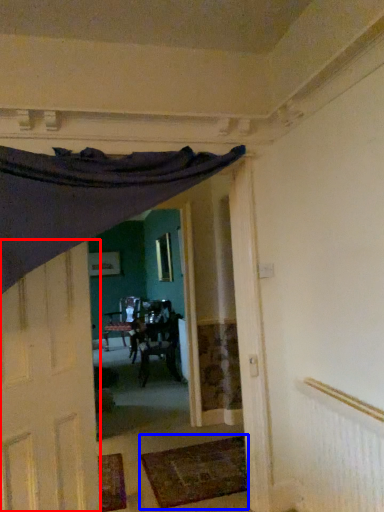
Question: Which object is further to the camera taking this photo, door (highlighted by a red box) or mat (highlighted by a blue box)?

Choices:
 (A) door
 (B) mat

Answer: (B)